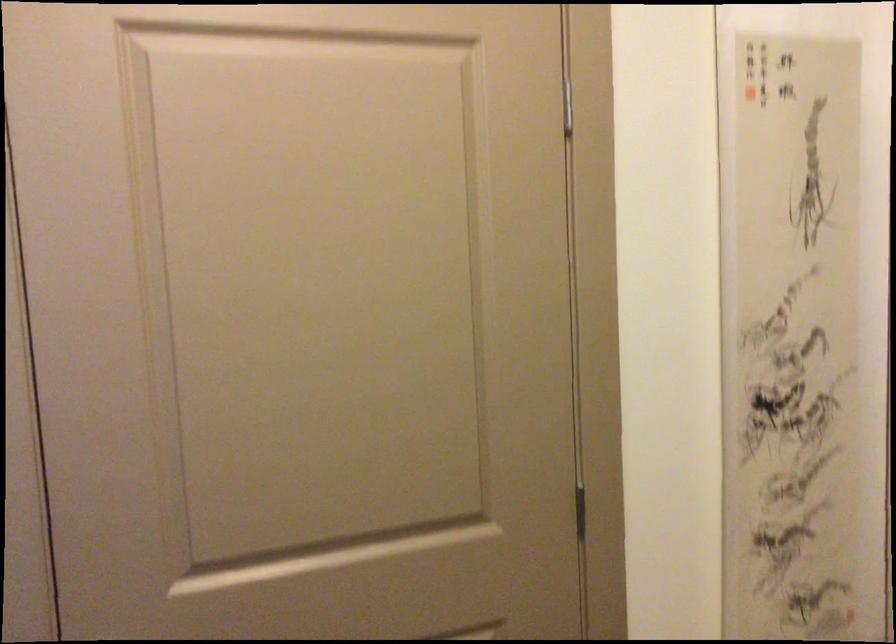
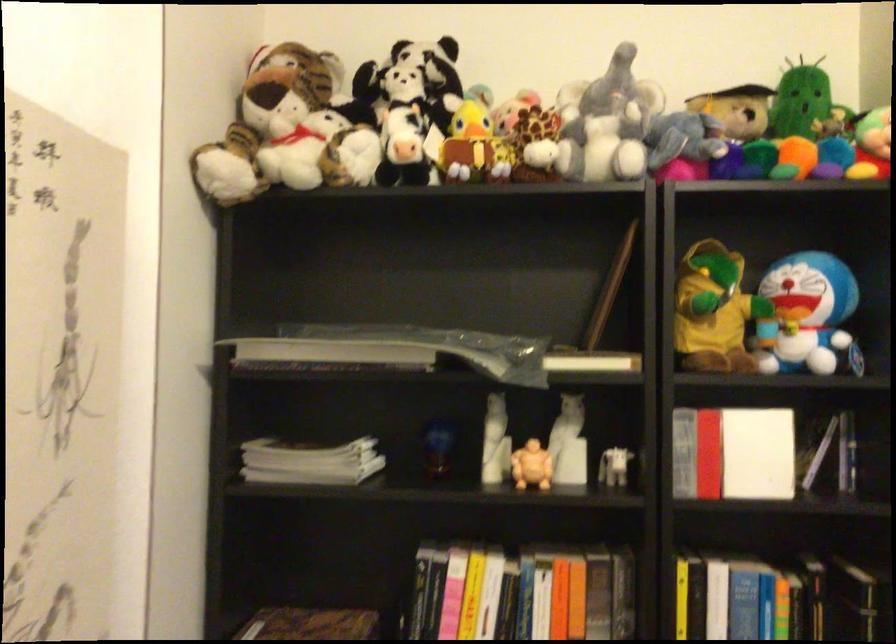
Question: The images are taken continuously from a first-person perspective. In which direction is your viewpoint rotating?

Choices:
 (A) Left
 (B) Right
 (C) Up
 (D) Down

Answer: (B)